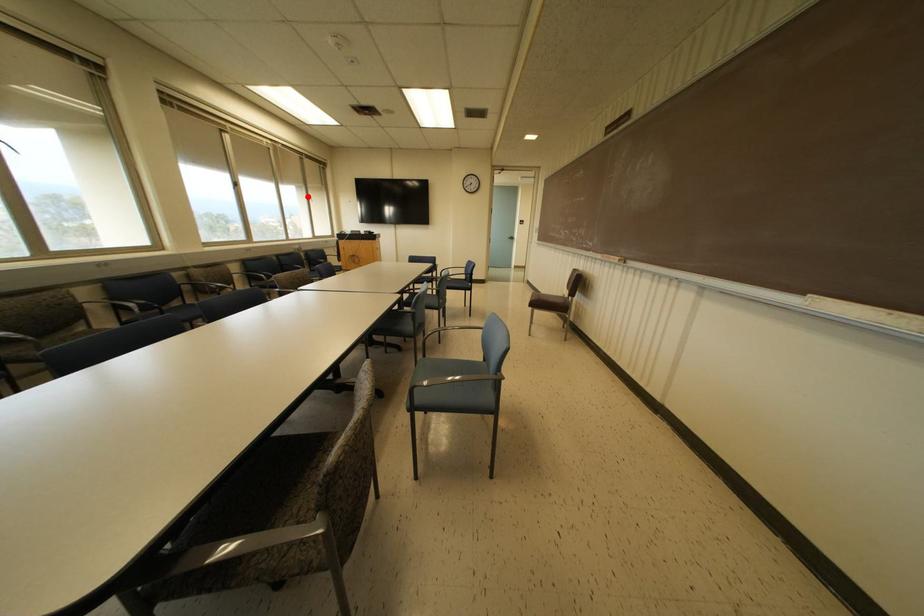
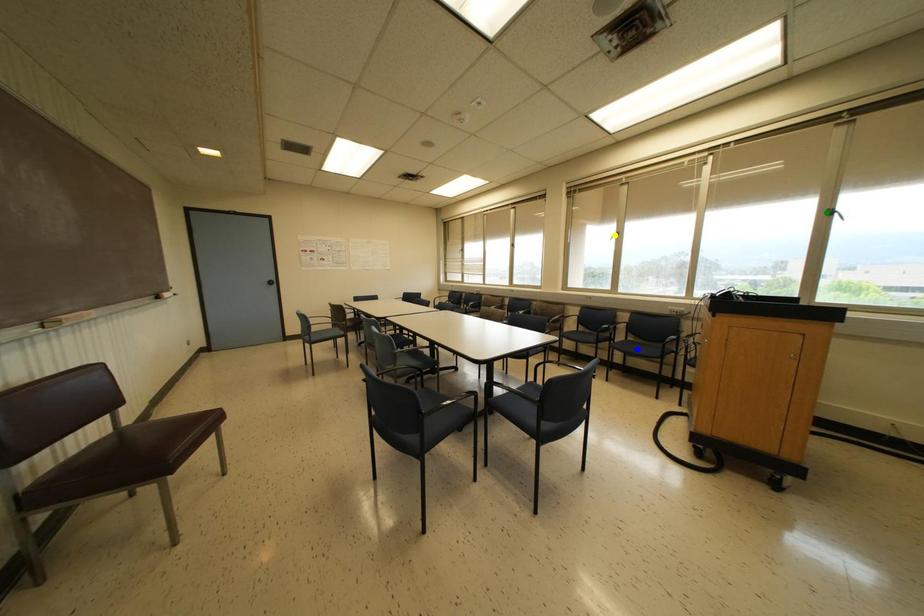
Question: I am providing you with two images of the same scene from different viewpoints. A red point is marked on the first image. You are given multiple points on the second image. Which spot in image 2 lines up with the point in image 1?

Choices:
 (A) yellow point
 (B) blue point
 (C) green point

Answer: (C)